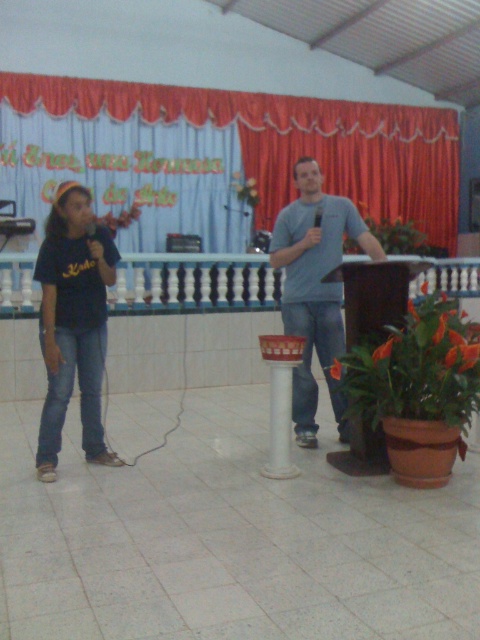
Question: Which object appears farthest from the camera in this image?

Choices:
 (A) white balustrade at center
 (B) blue fabric curtain at upper center
 (C) matte black shirt at left
 (D) matte gray t-shirt at center

Answer: (B)

Question: Is the position of blue fabric curtain at upper center more distant than that of matte black shirt at left?

Choices:
 (A) yes
 (B) no

Answer: (A)

Question: Can you confirm if blue fabric curtain at upper center is positioned to the right of matte black shirt at left?

Choices:
 (A) yes
 (B) no

Answer: (A)

Question: Among these objects, which one is farthest from the camera?

Choices:
 (A) white balustrade at center
 (B) blue fabric curtain at upper center

Answer: (B)

Question: Can you confirm if matte gray t-shirt at center is smaller than white balustrade at center?

Choices:
 (A) yes
 (B) no

Answer: (A)

Question: Which point is farther from the camera taking this photo?

Choices:
 (A) (446, 285)
 (B) (339, 300)
 (C) (248, 93)

Answer: (C)